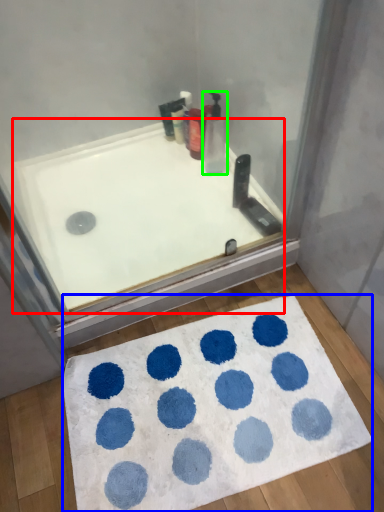
Question: Which is nearer to the bathtub (highlighted by a red box)? bath mat (highlighted by a blue box) or cleaning product (highlighted by a green box).

Choices:
 (A) bath mat
 (B) cleaning product

Answer: (B)